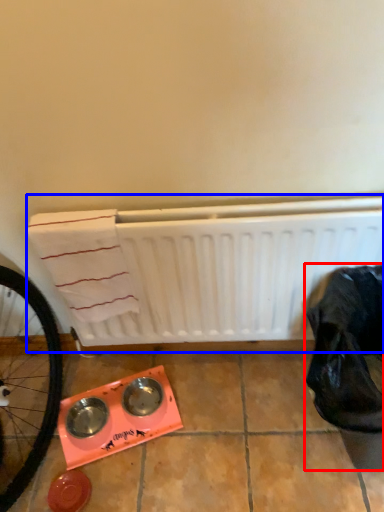
Question: Which object is further to the camera taking this photo, waste (highlighted by a red box) or water heater (highlighted by a blue box)?

Choices:
 (A) waste
 (B) water heater

Answer: (B)